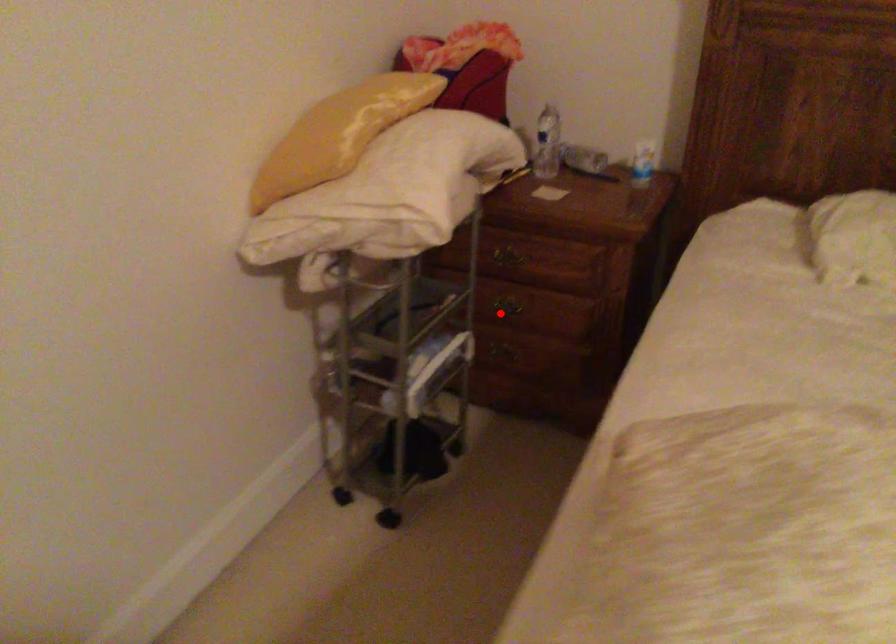
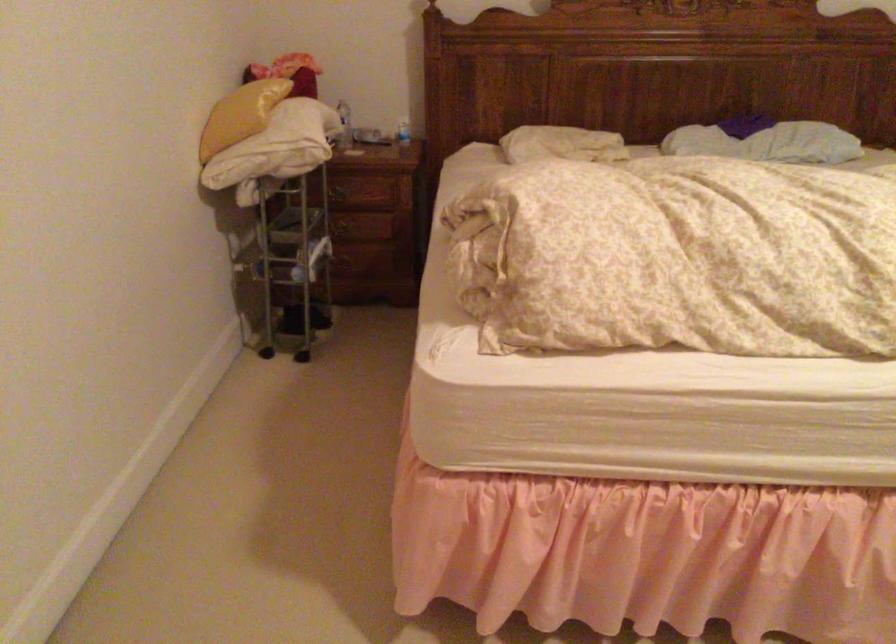
Question: I am providing you with two images of the same scene from different viewpoints. Image1 has a red point marked. In image2, the corresponding 3D location appears at what relative position? Reply with the corresponding letter.

Choices:
 (A) Closer
 (B) Farther

Answer: (B)